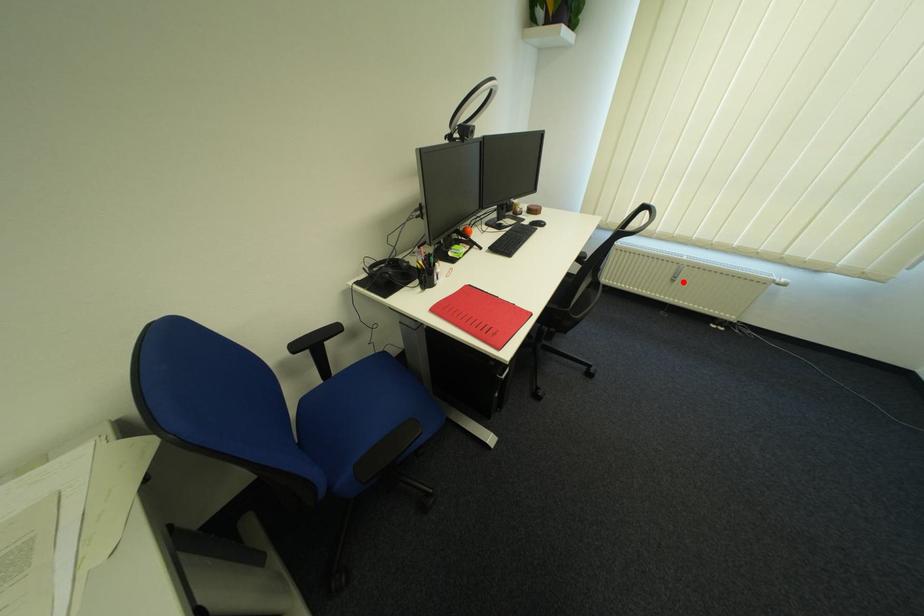
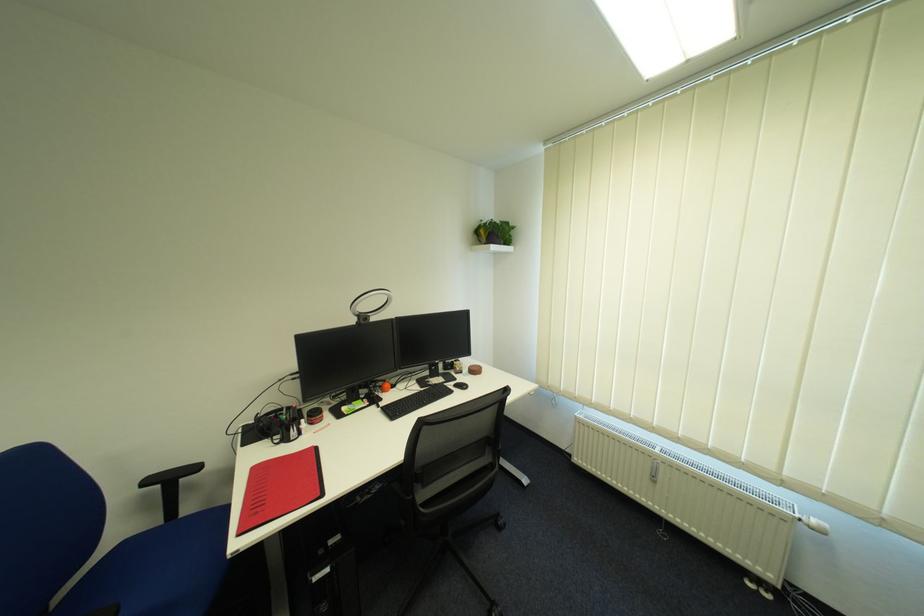
Where in the second image is the point corresponding to the highlighted location from the first image?

(664, 483)